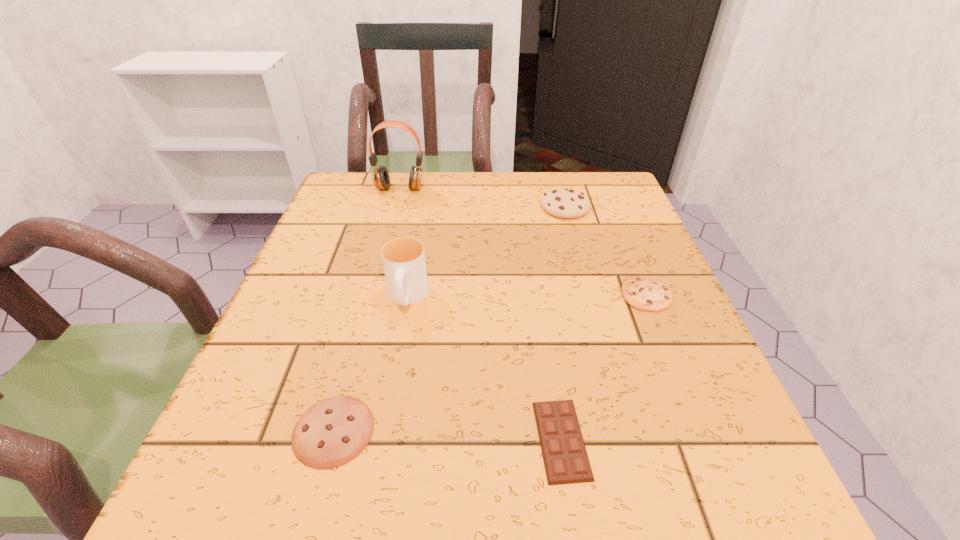
Locate an element on the screen. The width and height of the screenshot is (960, 540). vacant space at the near right corner is located at coordinates (707, 532).

Image resolution: width=960 pixels, height=540 pixels. I want to click on free spot between the nearest cookie and the shortest object, so click(x=447, y=435).

In order to click on vacant space that's between the shortest object and the fifth shortest object in this screenshot , I will do `click(484, 369)`.

You are a GUI agent. You are given a task and a screenshot of the screen. Output one action in this format:
    pyautogui.click(x=<x>, y=<y>)
    Task: Click on the free spot between the farthest object and the fifth nearest object
    This screenshot has height=540, width=960.
    Given the screenshot: What is the action you would take?
    pyautogui.click(x=482, y=198)

Locate an element on the screen. free point between the second farthest cookie and the tallest object is located at coordinates (523, 241).

You are a GUI agent. You are given a task and a screenshot of the screen. Output one action in this format:
    pyautogui.click(x=<x>, y=<y>)
    Task: Click on the vacant area that lies between the farthest object and the fourth shortest object
    
    Given the screenshot: What is the action you would take?
    pyautogui.click(x=482, y=198)

Where is `empty space between the shortest object and the second cookie from left to right`? This screenshot has width=960, height=540. empty space between the shortest object and the second cookie from left to right is located at coordinates (564, 323).

This screenshot has height=540, width=960. What are the coordinates of `empty space between the tallest object and the leftmost cookie` in the screenshot? It's located at (367, 309).

Identify the location of free space between the shortest object and the leftmost cookie. This screenshot has width=960, height=540. (447, 435).

Locate which object is the third closest to the chocolate bar. Please provide its 2D coordinates. Your answer should be formatted as a tuple, i.e. [(x, y)], where the tuple contains the x and y coordinates of a point satisfying the conditions above.

[(403, 258)]